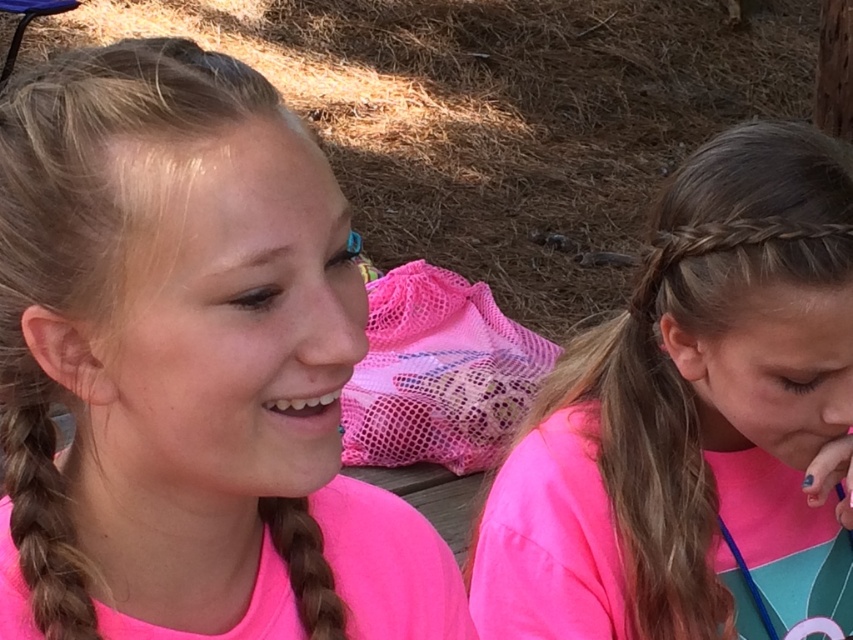
Is point (722, 273) positioned behind point (259, 499)?

Yes.

Does pink fabric shirt at right appear on the right side of brown silky hair at center?

Yes, pink fabric shirt at right is to the right of brown silky hair at center.

The height and width of the screenshot is (640, 853). I want to click on pink fabric shirt at right, so click(695, 420).

You are a GUI agent. You are given a task and a screenshot of the screen. Output one action in this format:
    pyautogui.click(x=<x>, y=<y>)
    Task: Click on the pink fabric shirt at right
    
    Given the screenshot: What is the action you would take?
    pyautogui.click(x=695, y=420)

Does brownhairponytail at left come behind brown silky hair at center?

No.

Can you confirm if brownhairponytail at left is wider than brown silky hair at center?

Yes.

Between point (16, 408) and point (322, 621), which one is positioned behind?

The point (322, 621) is more distant.

Identify the location of brownhairponytail at left. click(41, 508).

The height and width of the screenshot is (640, 853). What are the coordinates of `pink matte shirt at left` in the screenshot? It's located at (183, 362).

Is pink matte shirt at left thinner than brown silky hair at center?

No.

Is point (434, 580) positioned in front of point (263, 518)?

That is False.

The image size is (853, 640). What are the coordinates of `pink matte shirt at left` in the screenshot? It's located at (183, 362).